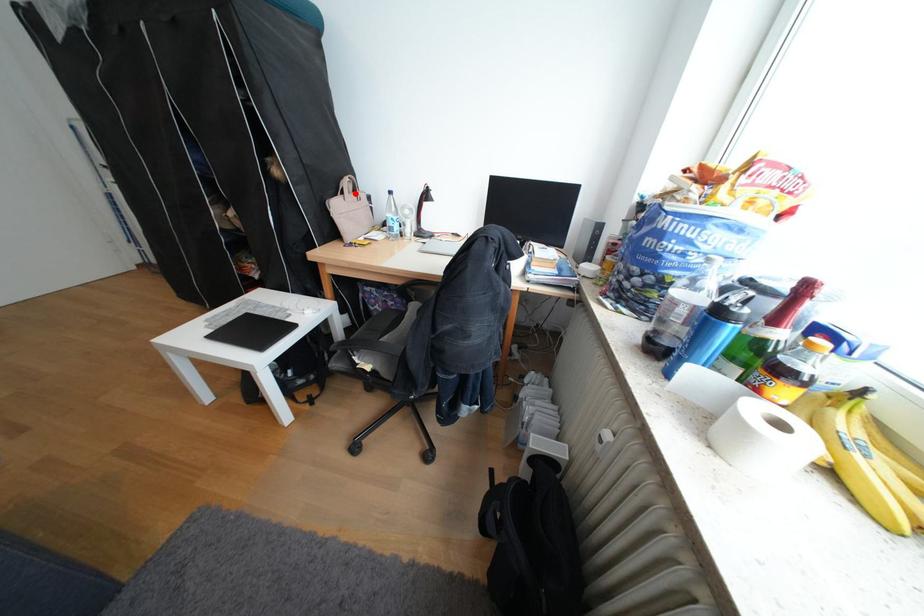
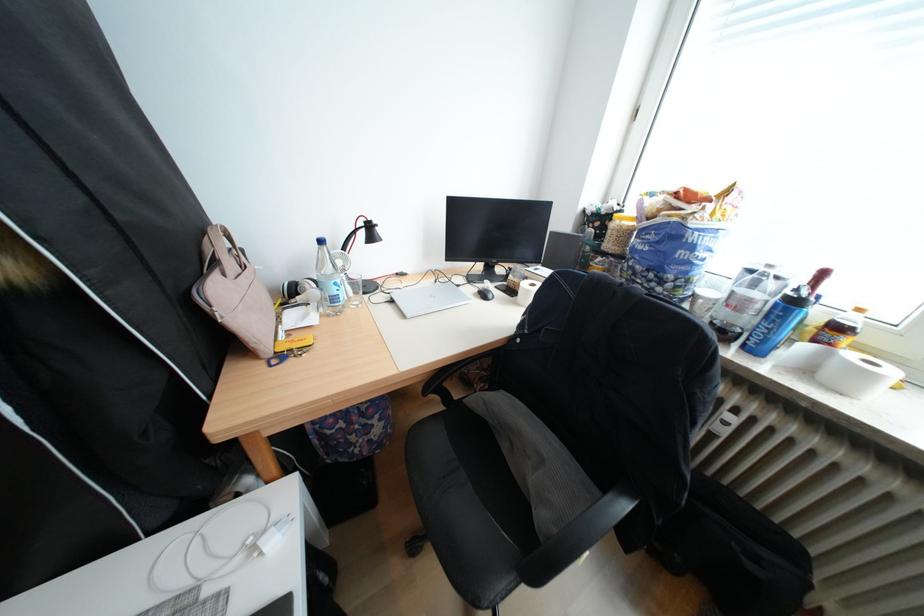
Where in the second image is the point corresponding to the highlighted location from the first image?

(227, 264)